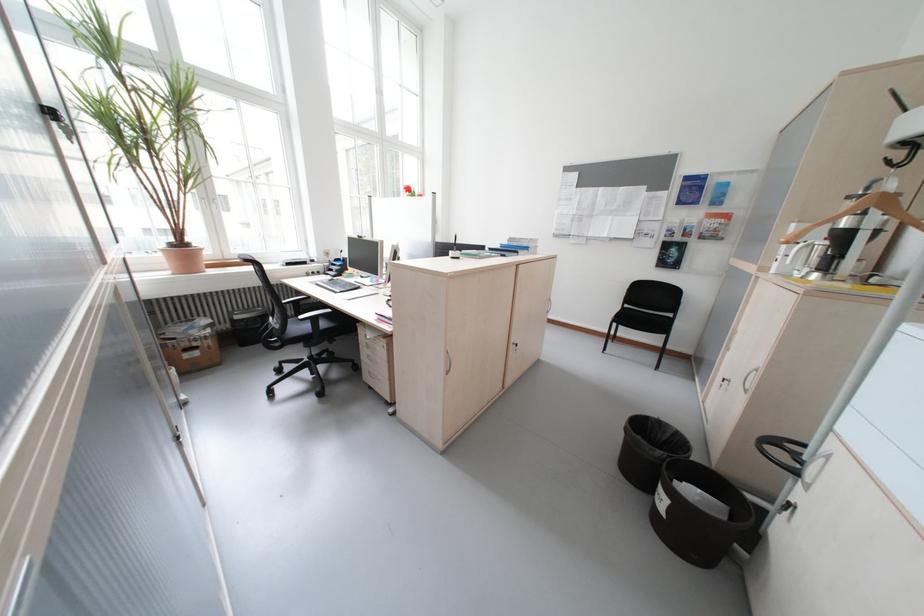
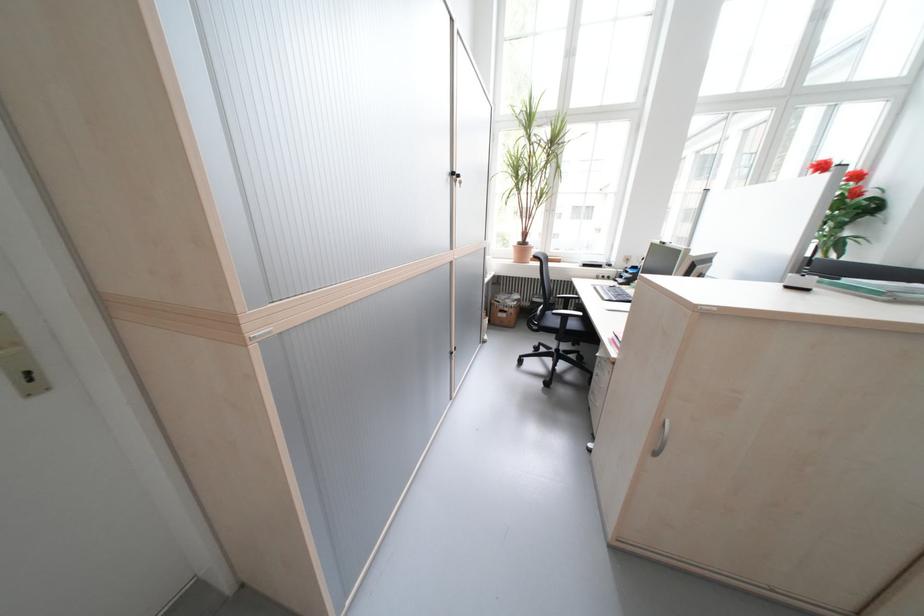
Find the pixel in the second image that matches pixel 334 325 in the first image.

(582, 326)